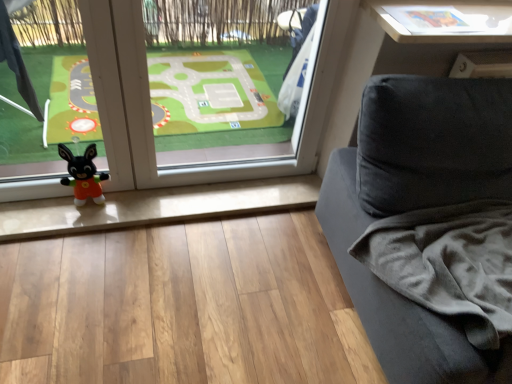
Question: From a real-world perspective, is white glossy table at upper right under transparent glass window at center?

Choices:
 (A) no
 (B) yes

Answer: (A)

Question: Is the position of white glossy table at upper right more distant than that of transparent glass window at center?

Choices:
 (A) no
 (B) yes

Answer: (B)

Question: Can you confirm if white glossy table at upper right is thinner than transparent glass window at center?

Choices:
 (A) yes
 (B) no

Answer: (A)

Question: From the image's perspective, would you say white glossy table at upper right is positioned over transparent glass window at center?

Choices:
 (A) no
 (B) yes

Answer: (B)

Question: Is the depth of white glossy table at upper right less than that of transparent glass window at center?

Choices:
 (A) no
 (B) yes

Answer: (A)

Question: Considering the relative positions of white glossy table at upper right and transparent glass window at center in the image provided, is white glossy table at upper right to the right of transparent glass window at center from the viewer's perspective?

Choices:
 (A) yes
 (B) no

Answer: (A)

Question: Is transparent glass window at center completely or partially outside of white glossy table at upper right?

Choices:
 (A) no
 (B) yes

Answer: (B)

Question: Is transparent glass window at center taller than white glossy table at upper right?

Choices:
 (A) yes
 (B) no

Answer: (A)

Question: Is transparent glass window at center shorter than white glossy table at upper right?

Choices:
 (A) no
 (B) yes

Answer: (A)

Question: From a real-world perspective, is transparent glass window at center located higher than white glossy table at upper right?

Choices:
 (A) yes
 (B) no

Answer: (B)

Question: Can you confirm if transparent glass window at center is wider than white glossy table at upper right?

Choices:
 (A) yes
 (B) no

Answer: (A)

Question: Is transparent glass window at center bigger than white glossy table at upper right?

Choices:
 (A) no
 (B) yes

Answer: (B)

Question: Would you say transparent glass window at center is inside or outside white glossy table at upper right?

Choices:
 (A) inside
 (B) outside

Answer: (B)